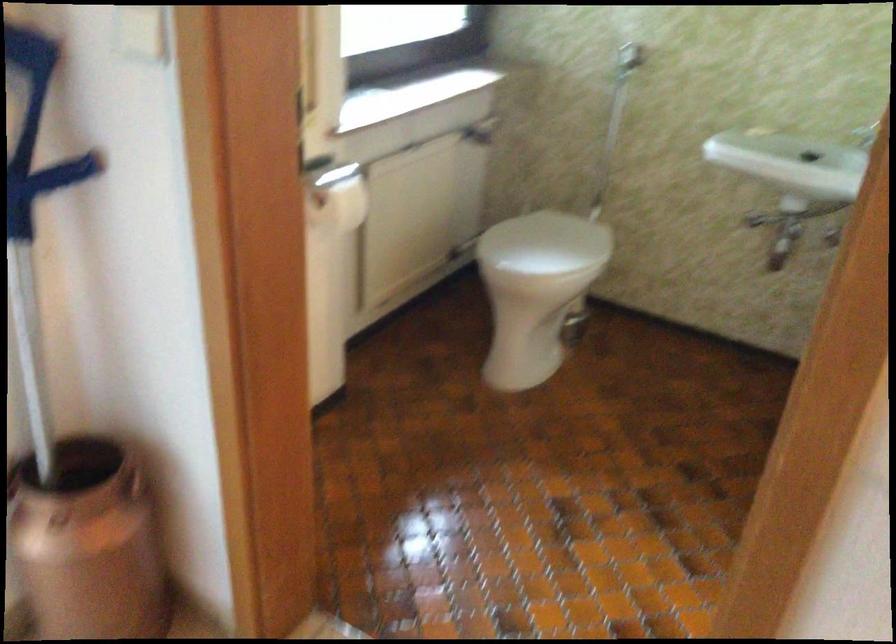
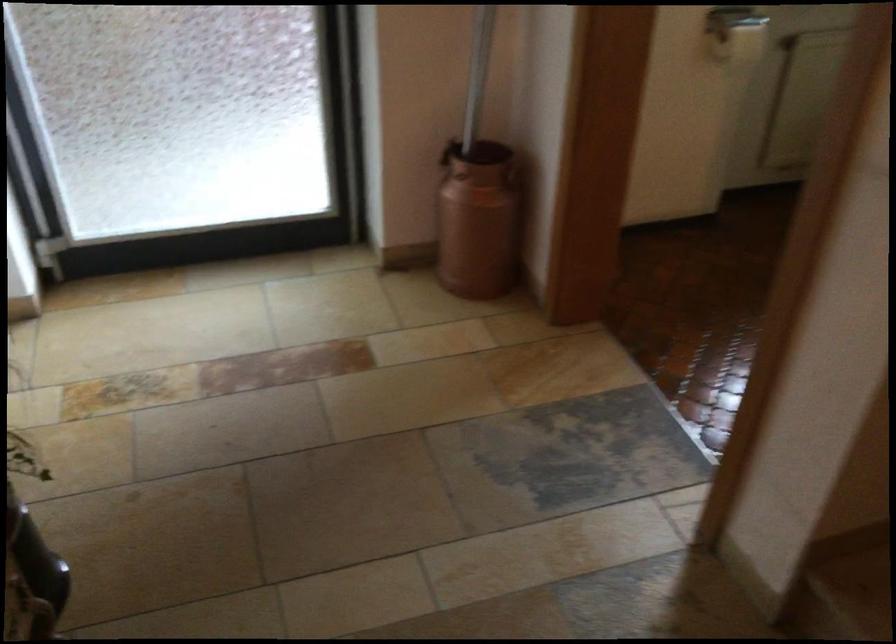
In the second image, find the point that corresponds to point 151,482 in the first image.

(513, 176)